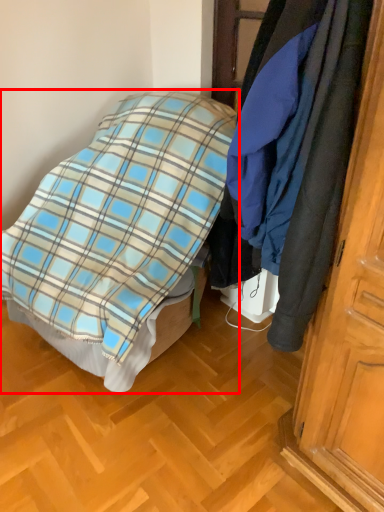
Question: In this image, where is bed (annotated by the red box) located relative to cloak?

Choices:
 (A) right
 (B) left

Answer: (B)